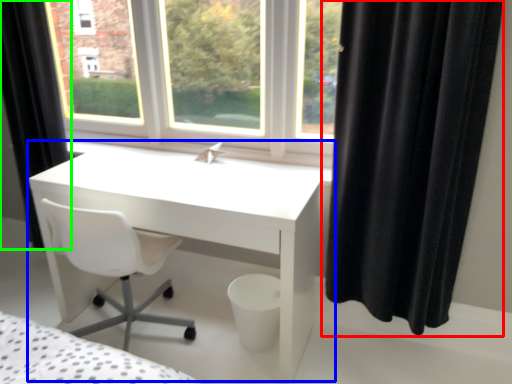
Question: Based on their relative distances, which object is nearer to curtain (highlighted by a red box)? Choose from table (highlighted by a blue box) and curtain (highlighted by a green box).

Choices:
 (A) table
 (B) curtain

Answer: (A)